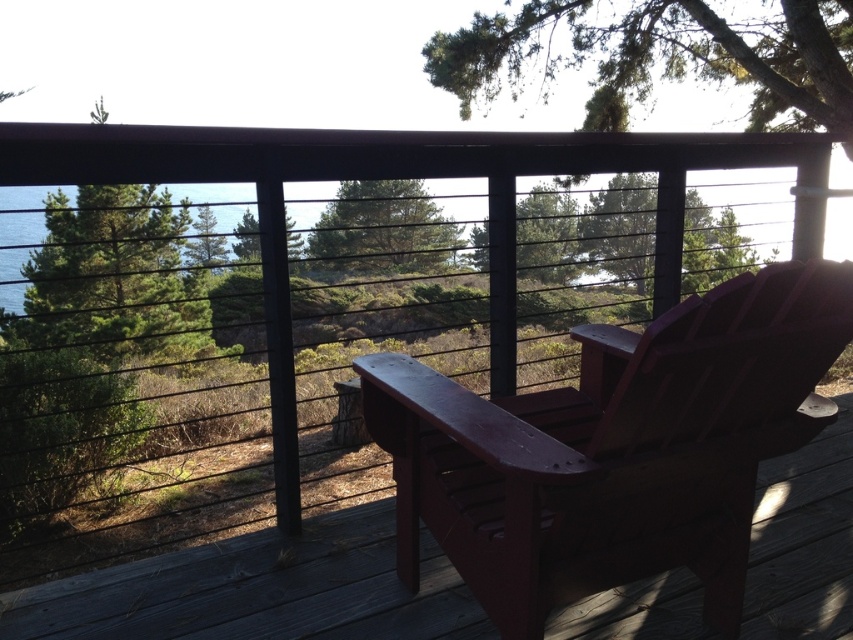
Question: Which point appears farthest from the camera in this image?

Choices:
 (A) (218, 225)
 (B) (93, 625)
 (C) (538, 502)
 (D) (819, 113)

Answer: (D)

Question: Which of the following is the closest to the observer?

Choices:
 (A) (222, 225)
 (B) (399, 218)

Answer: (A)

Question: Among these points, which one is farthest from the camera?

Choices:
 (A) (38, 196)
 (B) (515, 205)
 (C) (694, 595)
 (D) (782, 348)

Answer: (A)

Question: From the image, what is the correct spatial relationship of matte wood chair at center in relation to blue water at upper left?

Choices:
 (A) right
 (B) left

Answer: (A)

Question: Is the position of matte wood chair at center less distant than that of blue water at upper left?

Choices:
 (A) no
 (B) yes

Answer: (B)

Question: In this image, where is matte wood chair at center located relative to blue water at upper left?

Choices:
 (A) above
 (B) below

Answer: (B)